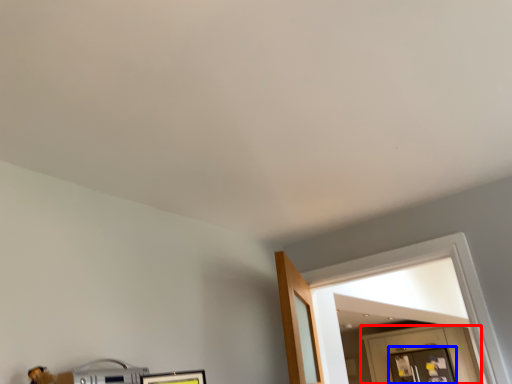
Question: Among these objects, which one is nearest to the camera, door (highlighted by a red box) or glass door (highlighted by a blue box)?

Choices:
 (A) door
 (B) glass door

Answer: (A)